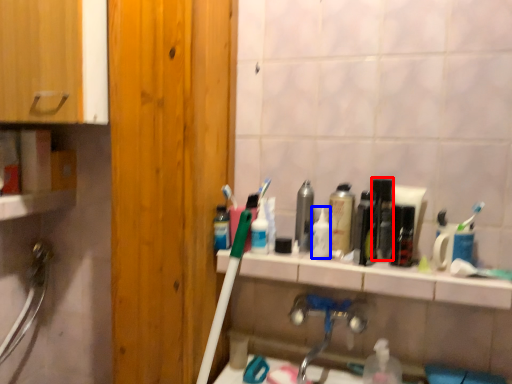
Question: Which point is closer to the camera, mouthwash (highlighted by a red box) or toiletry (highlighted by a blue box)?

Choices:
 (A) mouthwash
 (B) toiletry

Answer: (A)